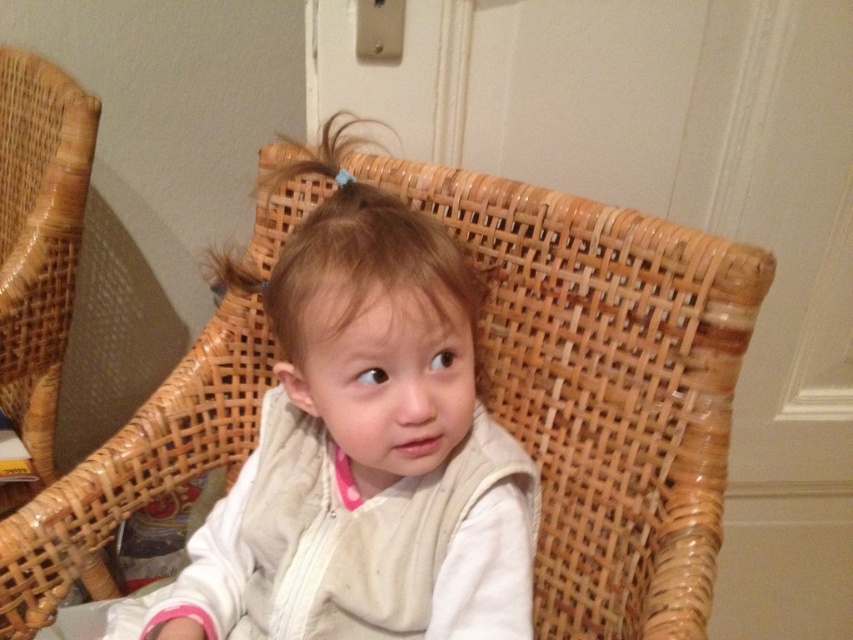
Question: Does white cotton baby at center come behind woven wood rocking chair at left?

Choices:
 (A) yes
 (B) no

Answer: (B)

Question: Among these objects, which one is nearest to the camera?

Choices:
 (A) white cotton baby at center
 (B) woven wood rocking chair at left

Answer: (A)

Question: Among these points, which one is nearest to the camera?

Choices:
 (A) (328, 234)
 (B) (49, 408)

Answer: (A)

Question: Does white cotton baby at center appear on the right side of woven wood rocking chair at left?

Choices:
 (A) yes
 (B) no

Answer: (A)

Question: Is white cotton baby at center bigger than woven wood rocking chair at left?

Choices:
 (A) yes
 (B) no

Answer: (B)